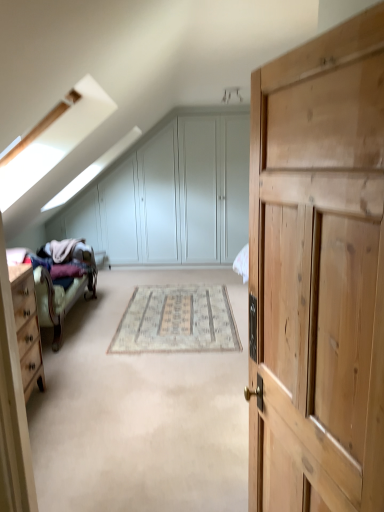
Question: Is wooden bed frame at left placed right next to natural wood cupboard at right?

Choices:
 (A) yes
 (B) no

Answer: (B)

Question: Is natural wood cupboard at right inside wooden bed frame at left?

Choices:
 (A) yes
 (B) no

Answer: (B)

Question: Is wooden bed frame at left closer to camera compared to natural wood cupboard at right?

Choices:
 (A) yes
 (B) no

Answer: (B)

Question: Does wooden bed frame at left have a lesser width compared to natural wood cupboard at right?

Choices:
 (A) no
 (B) yes

Answer: (A)

Question: From a real-world perspective, is wooden bed frame at left over natural wood cupboard at right?

Choices:
 (A) yes
 (B) no

Answer: (B)

Question: Considering their positions, is light wood dresser at left located in front of or behind natural wood cupboard at right?

Choices:
 (A) front
 (B) behind

Answer: (B)

Question: Is light wood dresser at left situated inside natural wood cupboard at right or outside?

Choices:
 (A) outside
 (B) inside

Answer: (A)

Question: In terms of height, does light wood dresser at left look taller or shorter compared to natural wood cupboard at right?

Choices:
 (A) short
 (B) tall

Answer: (A)

Question: Considering the positions of point (23, 393) and point (360, 103), is point (23, 393) closer or farther from the camera than point (360, 103)?

Choices:
 (A) closer
 (B) farther

Answer: (B)

Question: From the image's perspective, is white matte dresser at upper center positioned above or below wooden bed frame at left?

Choices:
 (A) below
 (B) above

Answer: (B)

Question: Considering the relative positions of white matte dresser at upper center and wooden bed frame at left in the image provided, is white matte dresser at upper center to the left or to the right of wooden bed frame at left?

Choices:
 (A) right
 (B) left

Answer: (A)

Question: Considering the positions of point (112, 254) and point (92, 279), is point (112, 254) closer or farther from the camera than point (92, 279)?

Choices:
 (A) closer
 (B) farther

Answer: (B)

Question: From their relative heights in the image, would you say white matte dresser at upper center is taller or shorter than wooden bed frame at left?

Choices:
 (A) short
 (B) tall

Answer: (B)

Question: Based on their sizes in the image, would you say beige woven rug at center is bigger or smaller than velvet purple blanket at left?

Choices:
 (A) big
 (B) small

Answer: (B)

Question: Looking at their shapes, would you say beige woven rug at center is wider or thinner than velvet purple blanket at left?

Choices:
 (A) wide
 (B) thin

Answer: (A)